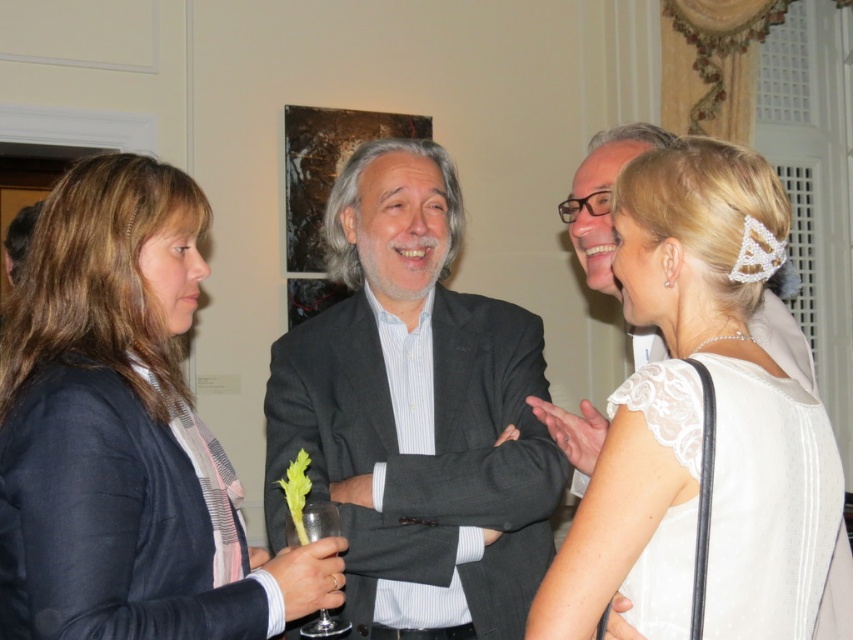
Question: Does matte black blazer at left have a greater width compared to dark gray suit at center?

Choices:
 (A) yes
 (B) no

Answer: (B)

Question: Is matte black blazer at left positioned before dark gray suit at center?

Choices:
 (A) no
 (B) yes

Answer: (B)

Question: Which object is the closest to the dark gray suit at center?

Choices:
 (A) white lace dress at center
 (B) matte black blazer at left

Answer: (B)

Question: Can you confirm if matte black blazer at left is positioned above clear glass wine glass at lower center?

Choices:
 (A) yes
 (B) no

Answer: (A)

Question: Among these objects, which one is farthest from the camera?

Choices:
 (A) clear glass wine glass at lower center
 (B) white lace dress at center
 (C) dark gray suit at center
 (D) matte black blazer at left

Answer: (C)

Question: Which point appears closest to the camera in this image?

Choices:
 (A) (630, 268)
 (B) (404, 228)
 (C) (224, 524)
 (D) (328, 636)

Answer: (A)